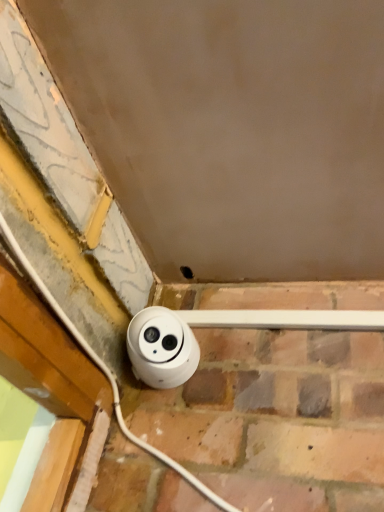
What do you see at coordinates (161, 348) in the screenshot?
I see `white plastic camera at bottom center` at bounding box center [161, 348].

I want to click on white plastic camera at bottom center, so click(161, 348).

Where is `white plastic camera at bottom center`? The height and width of the screenshot is (512, 384). white plastic camera at bottom center is located at coordinates (161, 348).